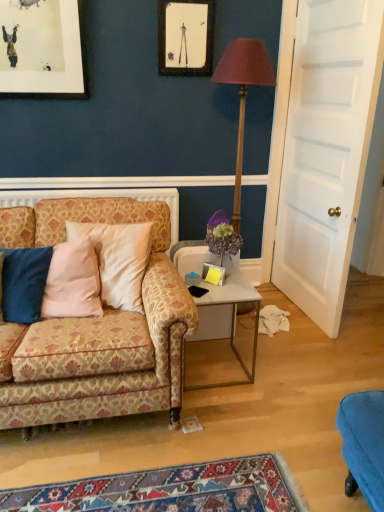
Question: From the image's perspective, is wooden floor lamp at center below white wooden door at right?

Choices:
 (A) yes
 (B) no

Answer: (A)

Question: Is white wooden door at right surrounded by wooden floor lamp at center?

Choices:
 (A) no
 (B) yes

Answer: (A)

Question: Considering the relative sizes of wooden floor lamp at center and white wooden door at right in the image provided, is wooden floor lamp at center thinner than white wooden door at right?

Choices:
 (A) yes
 (B) no

Answer: (B)

Question: Is the position of wooden floor lamp at center less distant than that of white wooden door at right?

Choices:
 (A) yes
 (B) no

Answer: (B)

Question: From a real-world perspective, does wooden floor lamp at center stand above white wooden door at right?

Choices:
 (A) yes
 (B) no

Answer: (B)

Question: Is the depth of wooden floor lamp at center greater than that of white wooden door at right?

Choices:
 (A) yes
 (B) no

Answer: (A)

Question: Can you confirm if white wooden door at right is bigger than white glossy side table at center?

Choices:
 (A) no
 (B) yes

Answer: (B)

Question: Does white wooden door at right lie behind white glossy side table at center?

Choices:
 (A) no
 (B) yes

Answer: (A)

Question: Would you say white wooden door at right is outside white glossy side table at center?

Choices:
 (A) yes
 (B) no

Answer: (A)

Question: Could you tell me if white wooden door at right is facing white glossy side table at center?

Choices:
 (A) no
 (B) yes

Answer: (B)

Question: Are white wooden door at right and white glossy side table at center far apart?

Choices:
 (A) yes
 (B) no

Answer: (B)

Question: Considering the relative positions of white wooden door at right and white glossy side table at center in the image provided, is white wooden door at right to the right of white glossy side table at center from the viewer's perspective?

Choices:
 (A) yes
 (B) no

Answer: (A)

Question: Can you confirm if wooden floor lamp at center is bigger than matte black picture frame at upper center?

Choices:
 (A) yes
 (B) no

Answer: (A)